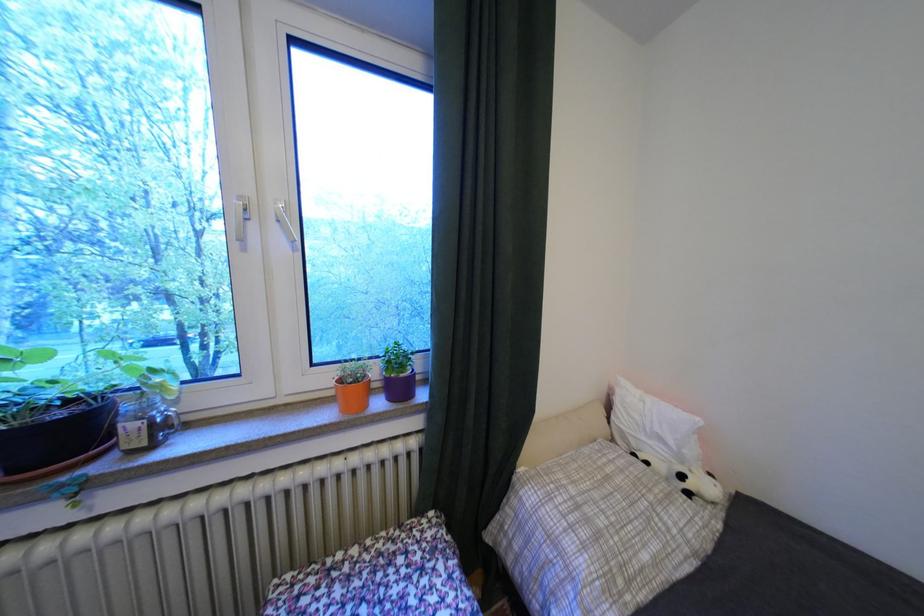
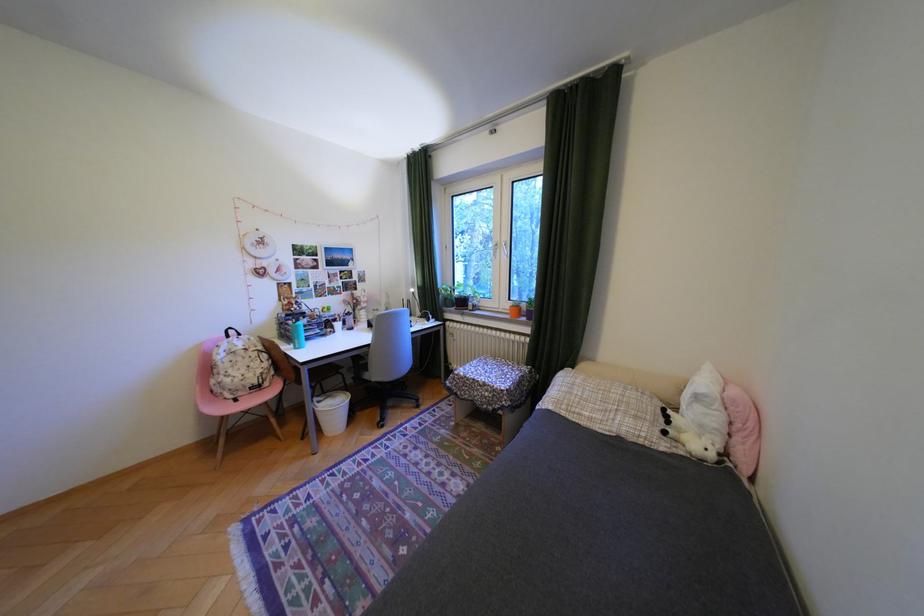
The point at (x=75, y=436) is marked in the first image. Where is the corresponding point in the second image?

(475, 302)